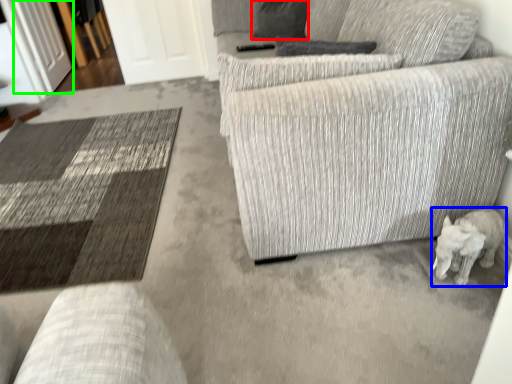
Question: Based on their relative distances, which object is nearer to pillow (highlighted by a red box)? Choose from animal (highlighted by a blue box) and glass door (highlighted by a green box).

Choices:
 (A) animal
 (B) glass door

Answer: (A)